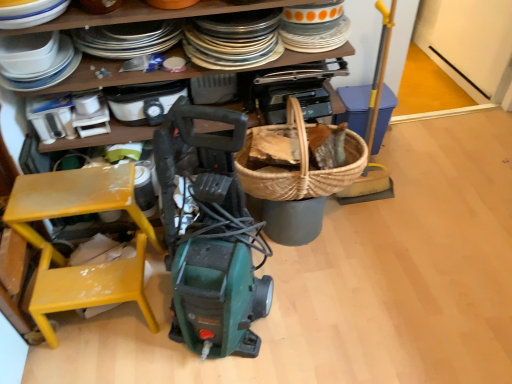
Question: Does green plastic vacuum cleaner at center have a lesser height compared to white glossy plates at upper left?

Choices:
 (A) no
 (B) yes

Answer: (B)

Question: Is green plastic vacuum cleaner at center taller than white glossy plates at upper left?

Choices:
 (A) yes
 (B) no

Answer: (B)

Question: From the image's perspective, is green plastic vacuum cleaner at center below white glossy plates at upper left?

Choices:
 (A) yes
 (B) no

Answer: (A)

Question: Can white glossy plates at upper left be found inside green plastic vacuum cleaner at center?

Choices:
 (A) no
 (B) yes

Answer: (A)

Question: Is green plastic vacuum cleaner at center positioned before white glossy plates at upper left?

Choices:
 (A) yes
 (B) no

Answer: (A)

Question: From the image's perspective, is green plastic vacuum cleaner at center on top of white glossy plates at upper left?

Choices:
 (A) yes
 (B) no

Answer: (B)

Question: Is white plastic toaster at upper center, the fourth appliance positioned from the left, outside of green plastic vacuum cleaner at center?

Choices:
 (A) no
 (B) yes

Answer: (B)

Question: Does white plastic toaster at upper center, the fourth appliance positioned from the left, have a greater height compared to green plastic vacuum cleaner at center?

Choices:
 (A) yes
 (B) no

Answer: (A)

Question: Considering the relative positions of white plastic toaster at upper center, the fourth appliance positioned from the left, and green plastic vacuum cleaner at center in the image provided, is white plastic toaster at upper center, the fourth appliance positioned from the left, in front of green plastic vacuum cleaner at center?

Choices:
 (A) no
 (B) yes

Answer: (A)

Question: From the image's perspective, is white plastic toaster at upper center, the fourth appliance positioned from the left, beneath green plastic vacuum cleaner at center?

Choices:
 (A) no
 (B) yes

Answer: (A)

Question: Does white plastic toaster at upper center, the fourth appliance positioned from the left, have a lesser width compared to green plastic vacuum cleaner at center?

Choices:
 (A) yes
 (B) no

Answer: (A)

Question: Can you confirm if white plastic toaster at upper center, the fourth appliance positioned from the left, is wider than green plastic vacuum cleaner at center?

Choices:
 (A) yes
 (B) no

Answer: (B)

Question: From a real-world perspective, is woven basket at right, which ranks as the fifth appliance in left-to-right order, beneath white plastic toaster at upper center, the fourth appliance positioned from the left?

Choices:
 (A) yes
 (B) no

Answer: (A)